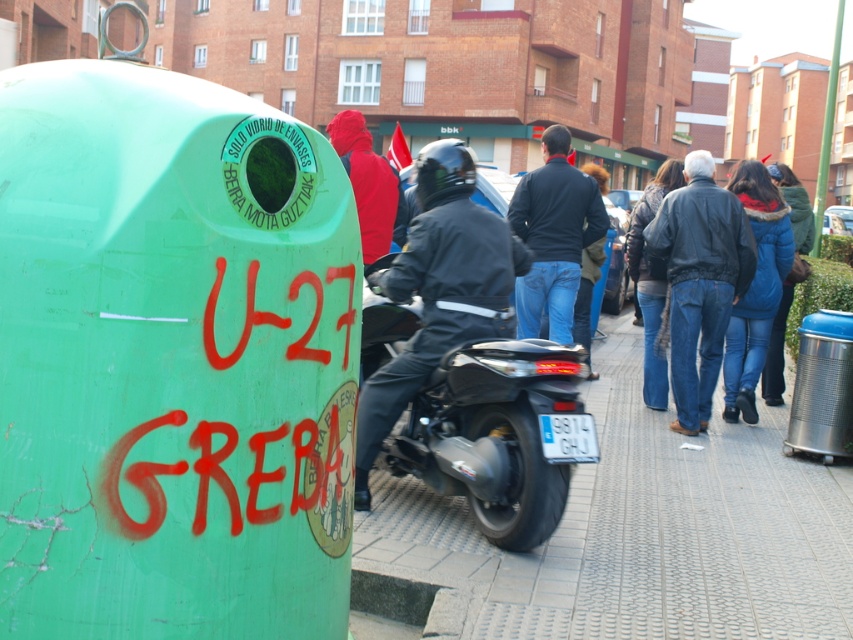
Question: Can you confirm if smooth concrete pavement at center is wider than blue denim jeans at lower right?

Choices:
 (A) no
 (B) yes

Answer: (B)

Question: Which point is closer to the camera?

Choices:
 (A) denim jacket at right
 (B) red fabric jacket at center
 (C) smooth concrete pavement at center
 (D) black matte motorcycle at center

Answer: (C)

Question: Is dark blue jacket at center below blue puffy coat at center?

Choices:
 (A) yes
 (B) no

Answer: (A)

Question: Which of the following is the farthest from the observer?

Choices:
 (A) (676, 177)
 (B) (370, 330)
 (C) (689, 392)

Answer: (A)

Question: Estimate the real-world distances between objects in this image. Which object is farther from the red fabric jacket at center?

Choices:
 (A) blue denim jeans at lower right
 (B) blue puffy coat at center
 (C) black leather jacket at center
 (D) denim jacket at right

Answer: (B)

Question: Can you confirm if smooth concrete pavement at center is positioned to the right of denim jacket at right?

Choices:
 (A) no
 (B) yes

Answer: (A)